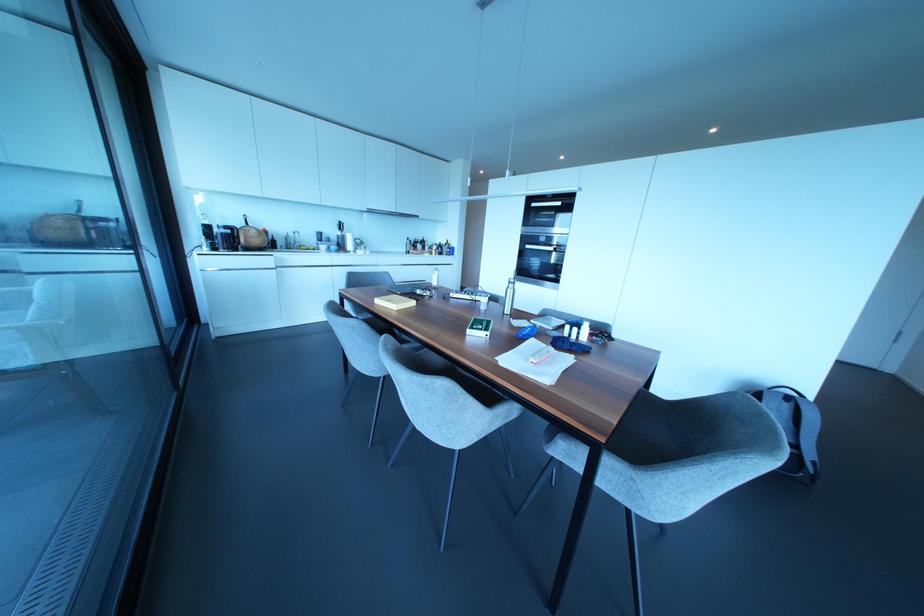
Which object does [794,428] point to?

This point indicates the gray backpack.